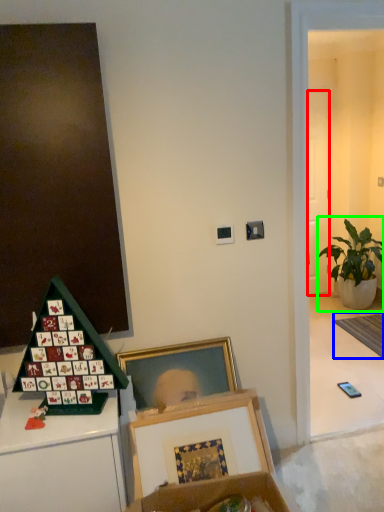
Question: Which object is positioned farthest from door (highlighted by a red box)? Select from mat (highlighted by a blue box) and houseplant (highlighted by a green box).

Choices:
 (A) mat
 (B) houseplant

Answer: (A)